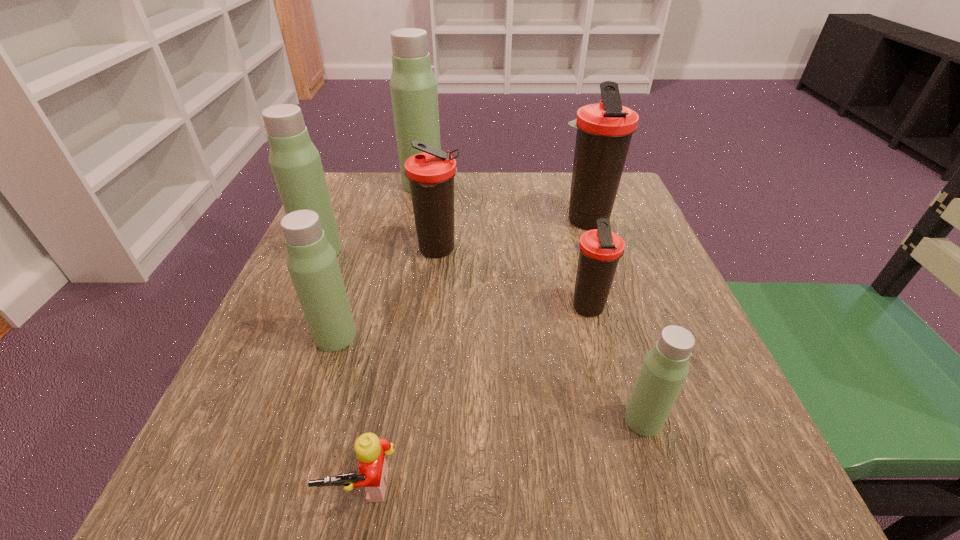
Locate an element on the screen. The height and width of the screenshot is (540, 960). the third closest brown thermos bottle to the second smallest light thermos bottle is located at coordinates (604, 130).

I want to click on brown thermos bottle that is the third closest to the second thermos bottle from left to right, so click(604, 130).